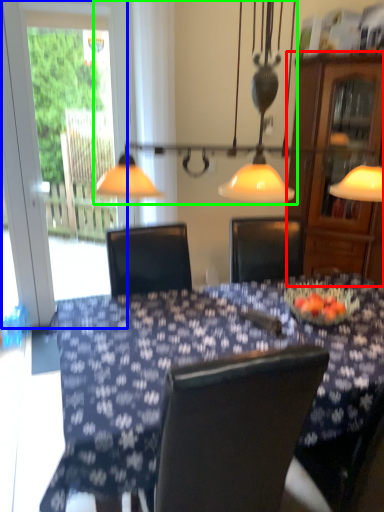
Question: Based on their relative distances, which object is farther from cabinetry (highlighted by a red box)? Choose from screen door (highlighted by a blue box) and lamp (highlighted by a green box).

Choices:
 (A) screen door
 (B) lamp

Answer: (A)